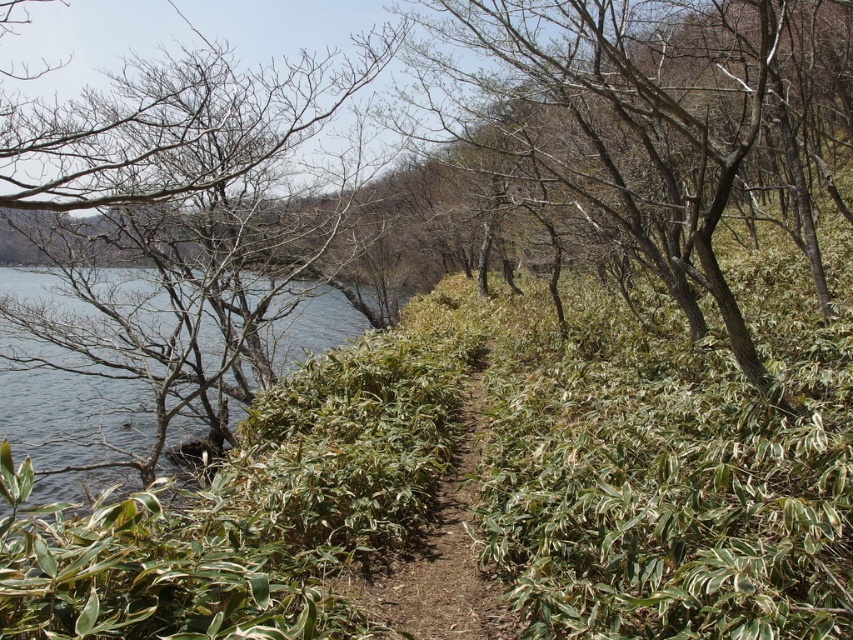
Which is behind, point (100, 193) or point (436, 611)?

Point (100, 193)

Which is more to the left, bare branches at left or brown dirt path at center?

bare branches at left

At what (x,y) coordinates should I click in order to perform the action: click on bare branches at left. Please return your answer as a coordinate pair (x, y). The width and height of the screenshot is (853, 640). Looking at the image, I should click on (171, 248).

Can you confirm if bare branches at left is taller than green leafy shrub at center?

Correct, bare branches at left is much taller as green leafy shrub at center.

Is bare branches at left bigger than green leafy shrub at center?

Indeed, bare branches at left has a larger size compared to green leafy shrub at center.

Locate an element on the screen. This screenshot has height=640, width=853. bare branches at left is located at coordinates (171, 248).

Does green leafy shrub at center have a greater width compared to brown dirt path at center?

Indeed, green leafy shrub at center has a greater width compared to brown dirt path at center.

Can you confirm if green leafy shrub at center is positioned to the left of brown dirt path at center?

In fact, green leafy shrub at center is to the right of brown dirt path at center.

This screenshot has height=640, width=853. What do you see at coordinates (624, 120) in the screenshot?
I see `green leafy shrub at center` at bounding box center [624, 120].

This screenshot has height=640, width=853. I want to click on green leafy shrub at center, so click(624, 120).